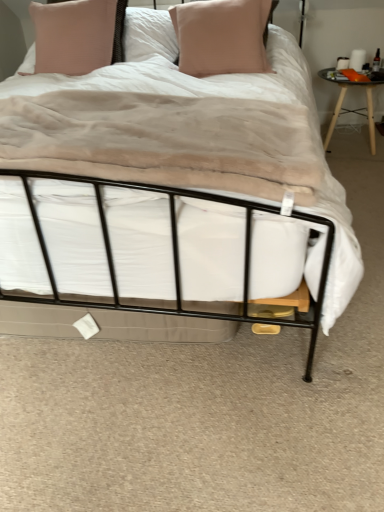
Question: Is matte pink pillow at upper center, which ranks as the 2th pillow in right-to-left order, not near black glass table at right?

Choices:
 (A) yes
 (B) no

Answer: (A)

Question: Considering the relative sizes of matte pink pillow at upper center, which ranks as the 2th pillow in right-to-left order, and black glass table at right in the image provided, is matte pink pillow at upper center, which ranks as the 2th pillow in right-to-left order, bigger than black glass table at right?

Choices:
 (A) yes
 (B) no

Answer: (B)

Question: Does matte pink pillow at upper center, positioned as the 1th pillow in left-to-right order, appear on the right side of black glass table at right?

Choices:
 (A) no
 (B) yes

Answer: (A)

Question: From the image's perspective, is matte pink pillow at upper center, positioned as the 1th pillow in left-to-right order, under black glass table at right?

Choices:
 (A) yes
 (B) no

Answer: (B)

Question: Is matte pink pillow at upper center, positioned as the 1th pillow in left-to-right order, aimed at black glass table at right?

Choices:
 (A) no
 (B) yes

Answer: (A)

Question: In terms of width, does pink fabric pillow at center, placed as the first pillow when sorted from right to left, look wider or thinner when compared to black metal bed at center?

Choices:
 (A) thin
 (B) wide

Answer: (A)

Question: In the image, is pink fabric pillow at center, placed as the first pillow when sorted from right to left, positioned in front of or behind black metal bed at center?

Choices:
 (A) front
 (B) behind

Answer: (B)

Question: From a real-world perspective, relative to black metal bed at center, is pink fabric pillow at center, placed as the 2th pillow when sorted from left to right, vertically above or below?

Choices:
 (A) above
 (B) below

Answer: (A)

Question: Considering the positions of pink fabric pillow at center, placed as the 2th pillow when sorted from left to right, and black metal bed at center in the image, is pink fabric pillow at center, placed as the 2th pillow when sorted from left to right, taller or shorter than black metal bed at center?

Choices:
 (A) short
 (B) tall

Answer: (B)

Question: Is black metal bed at center wider or thinner than pink fabric pillow at center, placed as the first pillow when sorted from right to left?

Choices:
 (A) wide
 (B) thin

Answer: (A)

Question: Relative to pink fabric pillow at center, placed as the 2th pillow when sorted from left to right, is black metal bed at center in front or behind?

Choices:
 (A) front
 (B) behind

Answer: (A)

Question: From a real-world perspective, relative to pink fabric pillow at center, placed as the 2th pillow when sorted from left to right, is black metal bed at center vertically above or below?

Choices:
 (A) above
 (B) below

Answer: (B)

Question: From their relative heights in the image, would you say black metal bed at center is taller or shorter than pink fabric pillow at center, placed as the first pillow when sorted from right to left?

Choices:
 (A) short
 (B) tall

Answer: (A)

Question: Considering the positions of black metal bed at center and matte pink pillow at upper center, which ranks as the 2th pillow in right-to-left order, in the image, is black metal bed at center taller or shorter than matte pink pillow at upper center, which ranks as the 2th pillow in right-to-left order,?

Choices:
 (A) tall
 (B) short

Answer: (B)

Question: Considering the positions of black metal bed at center and matte pink pillow at upper center, positioned as the 1th pillow in left-to-right order, in the image, is black metal bed at center bigger or smaller than matte pink pillow at upper center, positioned as the 1th pillow in left-to-right order,?

Choices:
 (A) big
 (B) small

Answer: (A)